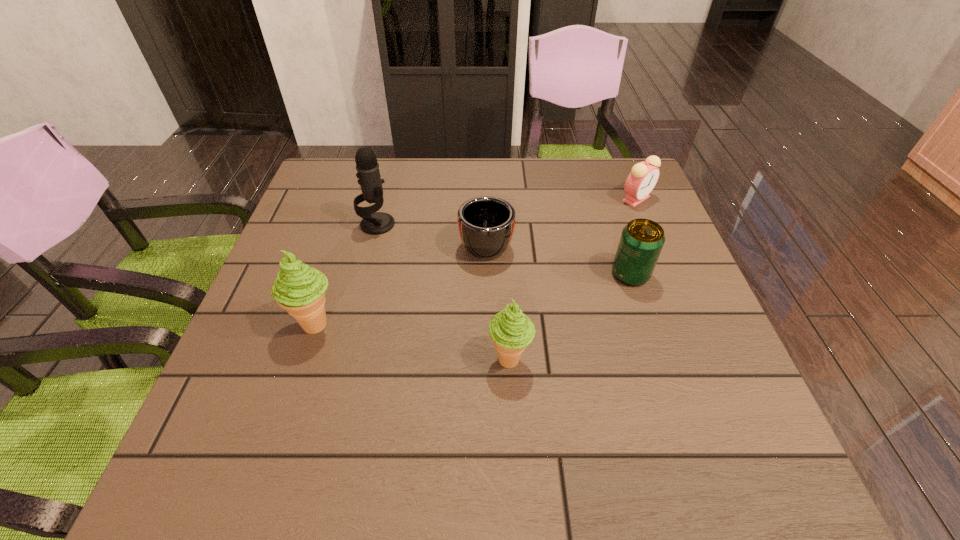
With all icecreams evenly spaced, where should an extra icecream be placed on the right to continue the pattern? Please point out a vacant space. Please provide its 2D coordinates. Your answer should be formatted as a tuple, i.e. [(x, y)], where the tuple contains the x and y coordinates of a point satisfying the conditions above.

[(732, 400)]